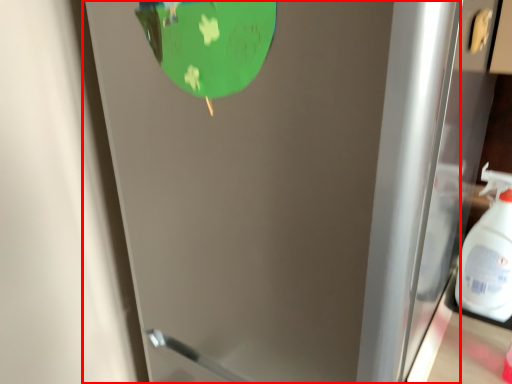
Question: From the image's perspective, what is the correct spatial positioning of door (annotated by the red box) in reference to cleaning product?

Choices:
 (A) above
 (B) below

Answer: (B)